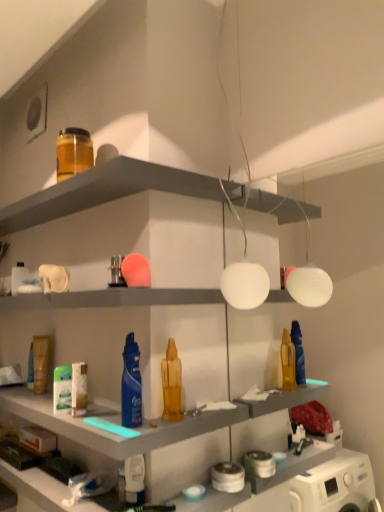
Question: From a real-world perspective, is metallic silver toiletry at center, the 4th toiletry positioned from the left, located beneath white glossy lotion at lower center, which appears as the sixth toiletry when viewed from the top?

Choices:
 (A) yes
 (B) no

Answer: (B)

Question: From the image's perspective, is metallic silver toiletry at center, marked as the third toiletry in a front-to-back arrangement, located above white glossy lotion at lower center, which is counted as the sixth toiletry, starting from the back?

Choices:
 (A) yes
 (B) no

Answer: (A)

Question: Is metallic silver toiletry at center, the fourth toiletry when ordered from back to front, oriented towards white glossy lotion at lower center, which is counted as the sixth toiletry, starting from the back?

Choices:
 (A) yes
 (B) no

Answer: (B)

Question: Does metallic silver toiletry at center, the fourth toiletry when ordered from back to front, have a smaller size compared to white glossy lotion at lower center, which appears as the sixth toiletry when viewed from the top?

Choices:
 (A) yes
 (B) no

Answer: (A)

Question: Considering the relative positions of metallic silver toiletry at center, the 4th toiletry positioned from the left, and white glossy lotion at lower center, acting as the first toiletry starting from the front, in the image provided, is metallic silver toiletry at center, the 4th toiletry positioned from the left, to the left of white glossy lotion at lower center, acting as the first toiletry starting from the front, from the viewer's perspective?

Choices:
 (A) no
 (B) yes

Answer: (B)

Question: Is translucent amber jar at upper left, placed as the 5th toiletry when sorted from right to left, bigger or smaller than white matte tube at center, which ranks as the 4th toiletry in right-to-left order?

Choices:
 (A) big
 (B) small

Answer: (A)

Question: Is translucent amber jar at upper left, which is the 2th toiletry from back to front, in front of or behind white matte tube at center, which ranks as the 4th toiletry in right-to-left order, in the image?

Choices:
 (A) behind
 (B) front

Answer: (A)

Question: Is translucent amber jar at upper left, which is counted as the second toiletry, starting from the left, wider or thinner than white matte tube at center, which ranks as the 4th toiletry in right-to-left order?

Choices:
 (A) thin
 (B) wide

Answer: (B)

Question: From a real-world perspective, relative to white matte tube at center, arranged as the 3th toiletry when ordered from the bottom, is translucent amber jar at upper left, which is the 2th toiletry from back to front, vertically above or below?

Choices:
 (A) below
 (B) above

Answer: (B)

Question: From the image's perspective, relative to matte plastic shelf at upper center, is blue glossy hair spray at center above or below?

Choices:
 (A) above
 (B) below

Answer: (B)

Question: Is point (120, 404) closer or farther from the camera than point (87, 184)?

Choices:
 (A) farther
 (B) closer

Answer: (B)

Question: From a real-world perspective, is blue glossy hair spray at center positioned above or below matte plastic shelf at upper center?

Choices:
 (A) below
 (B) above

Answer: (A)

Question: Relative to matte plastic shelf at upper center, is blue glossy hair spray at center in front or behind?

Choices:
 (A) front
 (B) behind

Answer: (B)

Question: Is blue glossy hair spray at center in front of or behind translucent amber jar at upper left, placed as the 5th toiletry when sorted from right to left, in the image?

Choices:
 (A) behind
 (B) front

Answer: (B)

Question: From a real-world perspective, is blue glossy hair spray at center positioned above or below translucent amber jar at upper left, placed as the 5th toiletry when sorted from right to left?

Choices:
 (A) below
 (B) above

Answer: (A)